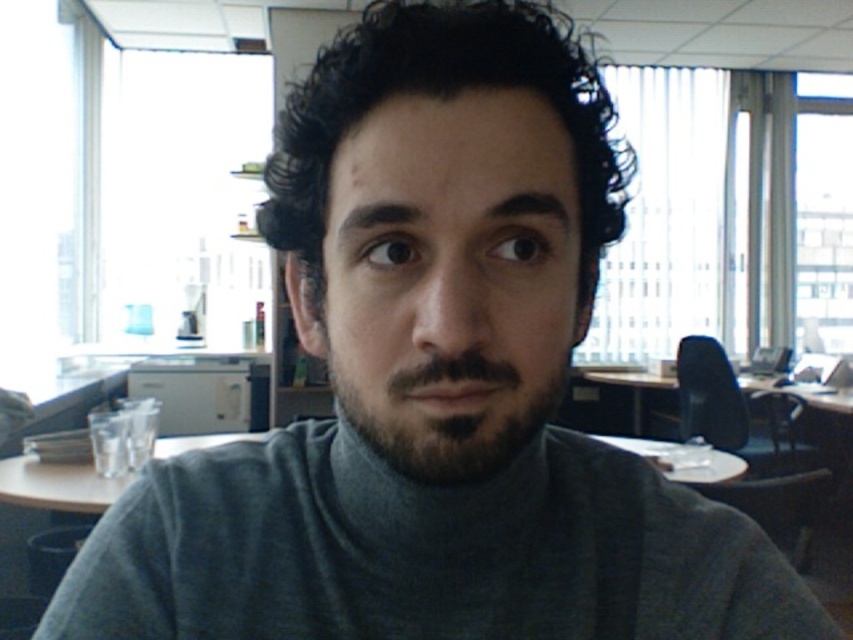
Question: Can you confirm if gray turtleneck sweater at center is positioned above dark brown fuzzy beard at center?

Choices:
 (A) yes
 (B) no

Answer: (B)

Question: Considering the relative positions of gray turtleneck sweater at center and dark brown fuzzy beard at center in the image provided, where is gray turtleneck sweater at center located with respect to dark brown fuzzy beard at center?

Choices:
 (A) left
 (B) right

Answer: (A)

Question: Among these points, which one is farthest from the camera?

Choices:
 (A) (561, 513)
 (B) (376, 376)

Answer: (A)

Question: Can you confirm if gray turtleneck sweater at center is thinner than dark brown fuzzy beard at center?

Choices:
 (A) yes
 (B) no

Answer: (B)

Question: Which point is farther from the camera taking this photo?

Choices:
 (A) [x=439, y=532]
 (B) [x=426, y=332]

Answer: (A)